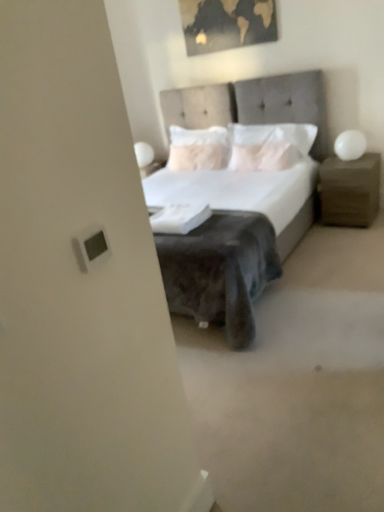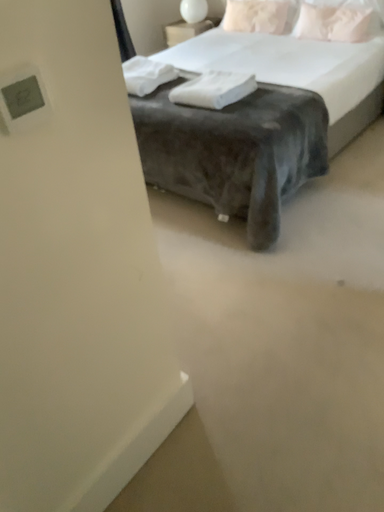
Question: How did the camera likely rotate when shooting the video?

Choices:
 (A) rotated left
 (B) rotated right

Answer: (A)